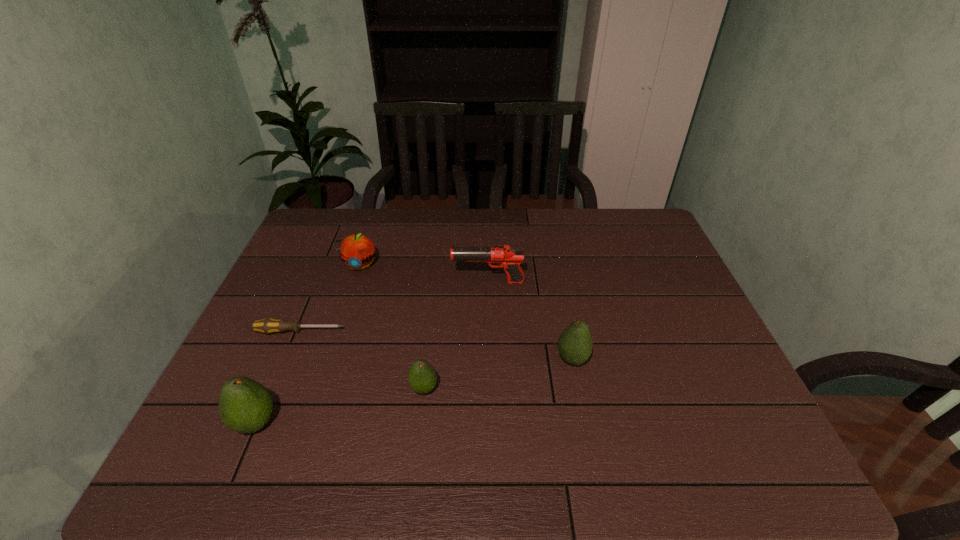
Where is `screwdriver that is at the left edge`? screwdriver that is at the left edge is located at coordinates (268, 326).

Locate an element on the screen. The height and width of the screenshot is (540, 960). object that is at the near left corner is located at coordinates (245, 406).

Where is `vacant region at the far edge of the desktop`? vacant region at the far edge of the desktop is located at coordinates (570, 217).

You are a GUI agent. You are given a task and a screenshot of the screen. Output one action in this format:
    pyautogui.click(x=<x>, y=<y>)
    Task: Click on the free space at the near edge of the desktop
    This screenshot has width=960, height=540.
    Given the screenshot: What is the action you would take?
    pyautogui.click(x=325, y=415)

You are a GUI agent. You are given a task and a screenshot of the screen. Output one action in this format:
    pyautogui.click(x=<x>, y=<y>)
    Task: Click on the free space at the left edge
    Image resolution: width=960 pixels, height=540 pixels.
    Given the screenshot: What is the action you would take?
    pyautogui.click(x=321, y=281)

In the image, there is a desktop. Where is `free space at the right edge`? The image size is (960, 540). free space at the right edge is located at coordinates (703, 367).

What are the coordinates of `vacant area at the far left corner of the desktop` in the screenshot? It's located at (340, 220).

You are a GUI agent. You are given a task and a screenshot of the screen. Output one action in this format:
    pyautogui.click(x=<x>, y=<y>)
    Task: Click on the vacant region at the near left corner of the desktop
    Image resolution: width=960 pixels, height=540 pixels.
    Given the screenshot: What is the action you would take?
    pyautogui.click(x=214, y=424)

Where is `free space between the second object from right to left and the leftmost avocado`? free space between the second object from right to left and the leftmost avocado is located at coordinates (372, 352).

Locate an element on the screen. free spot between the second avocado from left to right and the apple is located at coordinates (392, 327).